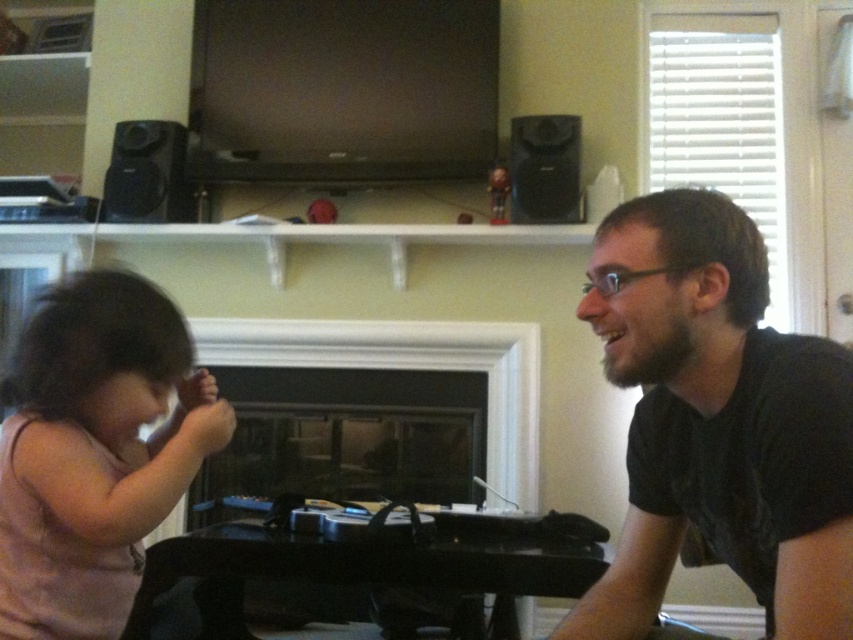
Looking at this image, you are a tailor who needs to determine which fabric to use for a new project. The black matte shirt at right and the pink fabric at left are available. If you need a wider piece of fabric, which one should you choose?

The black matte shirt at right has a larger width than the pink fabric at left, so you should choose the black matte shirt at right for the project requiring a wider fabric.